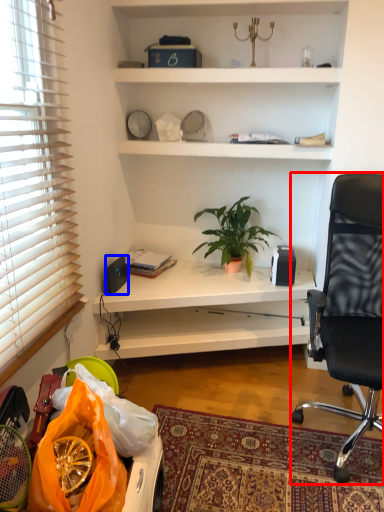
Question: Which object is closer to the camera taking this photo, chair (highlighted by a red box) or loudspeaker (highlighted by a blue box)?

Choices:
 (A) chair
 (B) loudspeaker

Answer: (A)